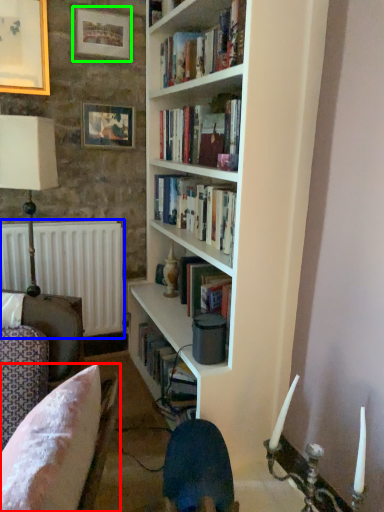
Question: Considering the real-world distances, which object is closest to chair (highlighted by a red box)? radiator (highlighted by a blue box) or picture frame (highlighted by a green box).

Choices:
 (A) radiator
 (B) picture frame

Answer: (A)